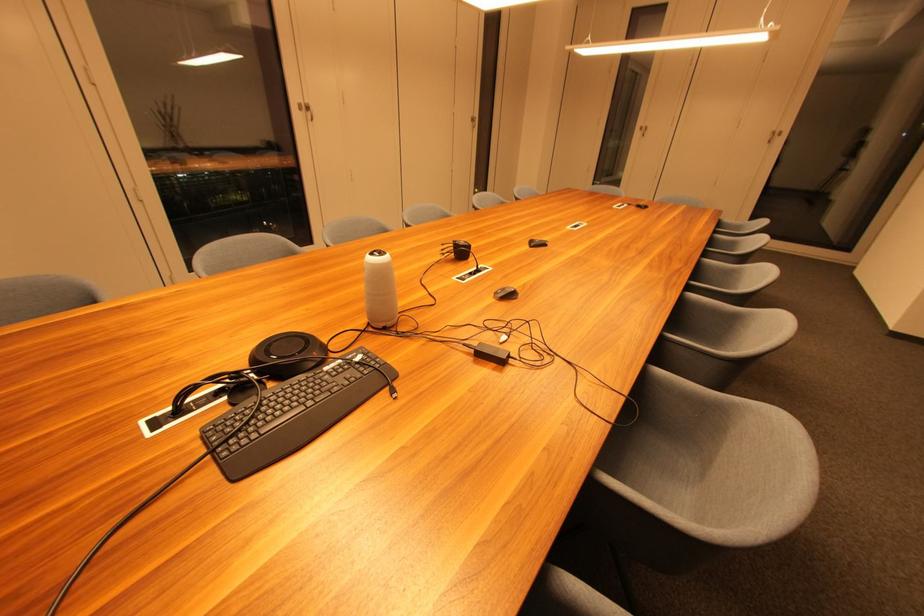
Find where to pull the door handle. Please return your answer as a coordinate pair (x, y).

(305, 108)